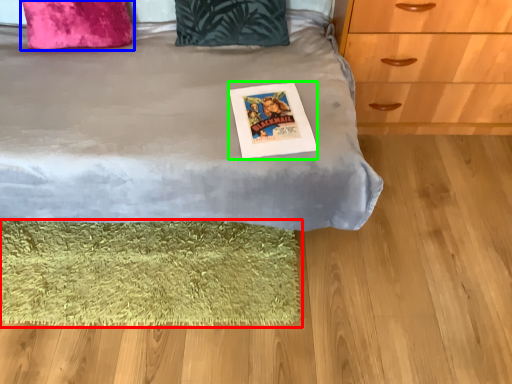
Question: Based on their relative distances, which object is farther from mat (highlighted by a red box)? Choose from pillow (highlighted by a blue box) and postcard (highlighted by a green box).

Choices:
 (A) pillow
 (B) postcard

Answer: (A)